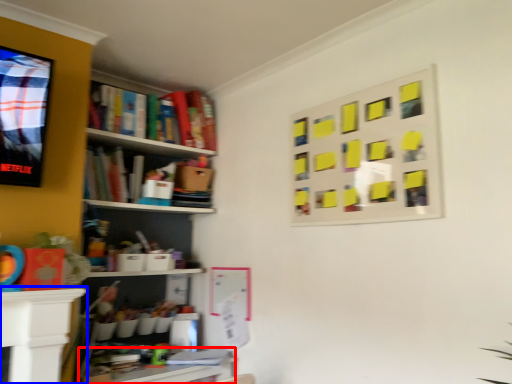
Question: Which object appears closest to the camera in this image, table (highlighted by a red box) or table (highlighted by a blue box)?

Choices:
 (A) table
 (B) table

Answer: (B)